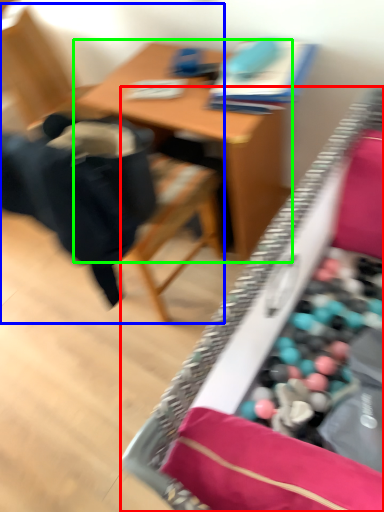
Question: Which object is the farthest from desk (highlighted by a red box)? Choose among these: chair (highlighted by a blue box) or table (highlighted by a green box).

Choices:
 (A) chair
 (B) table

Answer: (A)